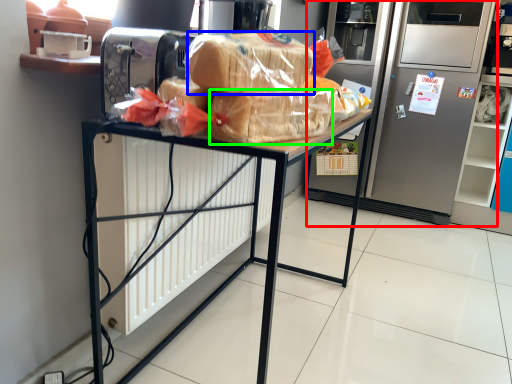
Question: Which object is positioned closest to refrigerator (highlighted by a red box)? Select from bread (highlighted by a blue box) and snack (highlighted by a green box).

Choices:
 (A) bread
 (B) snack

Answer: (B)